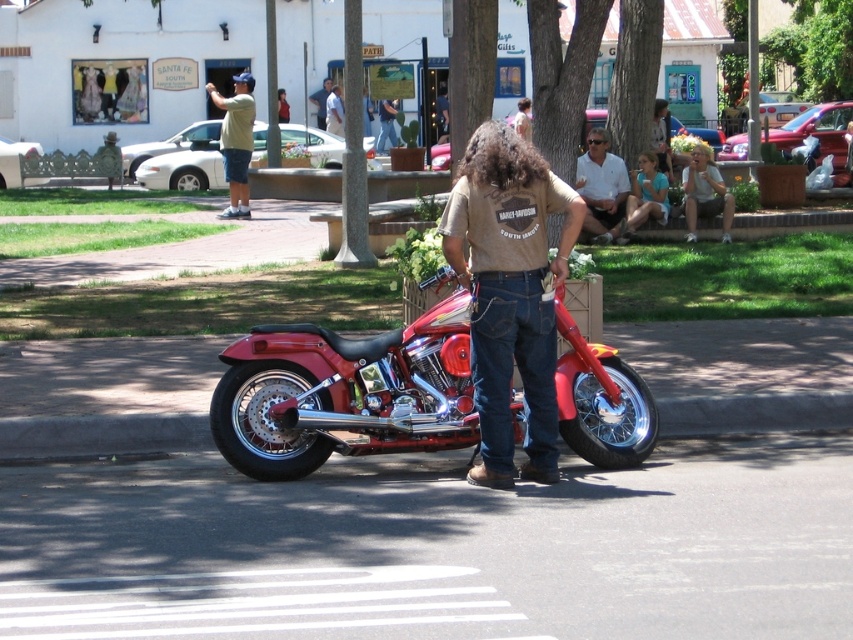
Who is more forward, (x=239, y=173) or (x=323, y=116)?

Point (x=239, y=173) is in front.

Does matte green t-shirt at upper center have a smaller size compared to brushed metal shirt at center?

No.

Is point (242, 99) more distant than point (312, 100)?

That is False.

Where is `matte green t-shirt at upper center`? matte green t-shirt at upper center is located at coordinates (236, 140).

Can you confirm if shiny red motorcycle at center is shorter than matte green t-shirt at upper center?

Correct, shiny red motorcycle at center is not as tall as matte green t-shirt at upper center.

Which of these two, shiny red motorcycle at center or matte green t-shirt at upper center, stands shorter?

Standing shorter between the two is shiny red motorcycle at center.

The height and width of the screenshot is (640, 853). Describe the element at coordinates (345, 392) in the screenshot. I see `shiny red motorcycle at center` at that location.

Identify the location of shiny red motorcycle at center. (345, 392).

Is white cotton polo shirt at center behind light blue denim shorts at center?

No, it is not.

Between point (616, 188) and point (624, 228), which one is positioned in front?

Point (624, 228)

Find the location of a particular element. This screenshot has width=853, height=640. white cotton polo shirt at center is located at coordinates (601, 186).